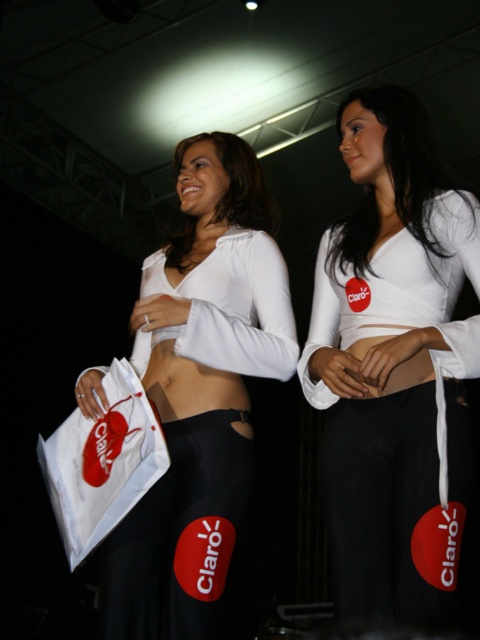
You are a photographer at the event and need to position a light to the left of the white paper bag at center. Will the light also be to the left of the white matte fabric top at center?

Yes, because the white matte fabric top at center is to the right of the white paper bag at center, so placing the light to the left of the bag would also place it to the left of the top.

You are a photographer adjusting your camera settings to focus on two specific points in the image. The points are labeled as point [336,230] and point [127,561]. Since you can only focus on one point at a time, which point should you choose to ensure the woman holding the shopping bag is in focus?

Point [336,230] is further to the camera than point [127,561]. Since the woman holding the shopping bag is likely closer to the camera, you should focus on point [336,230] to ensure she is in focus.

You are a photographer at a fashion show. You need to capture a closeup shot of the white matte fabric top at center and the white paper bag at center. Which object should you focus on first if you want to ensure both are in focus without changing the camera settings?

The white matte fabric top at center is bigger than the white paper bag at center. Since the top is larger, it will occupy more of the frame, so you should focus on the white matte fabric top at center first to ensure depth of field covers both objects.